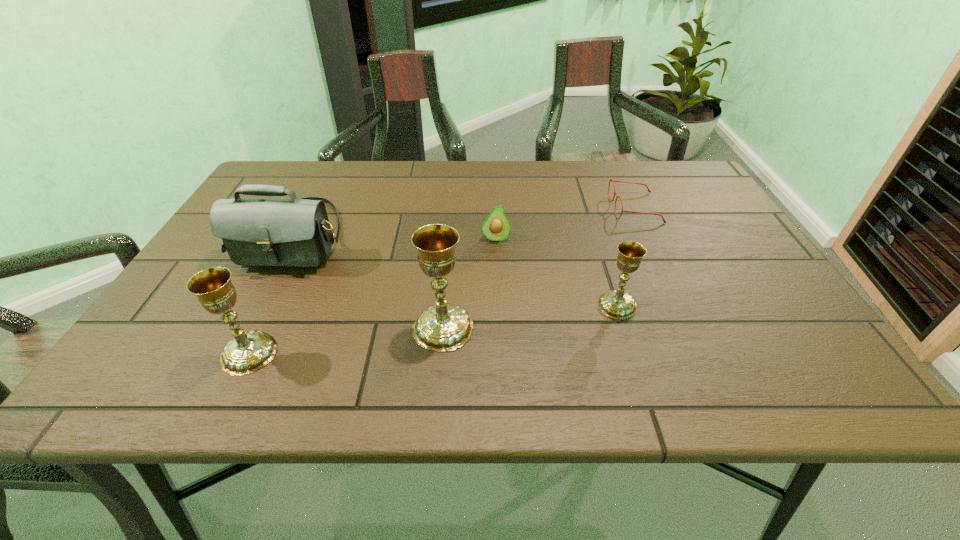
Identify the location of free space located 0.280m on the back of the leftmost chalice. (301, 245).

This screenshot has height=540, width=960. Identify the location of vacant space located 0.210m on the left of the tallest chalice. (307, 328).

At what (x,y) coordinates should I click in order to perform the action: click on blank space located 0.220m on the right of the shortest chalice. Please return your answer as a coordinate pair (x, y). Looking at the image, I should click on (741, 306).

Where is `vacant space situated on the face of the spectacles`? Image resolution: width=960 pixels, height=540 pixels. vacant space situated on the face of the spectacles is located at coordinates (583, 208).

You are a GUI agent. You are given a task and a screenshot of the screen. Output one action in this format:
    pyautogui.click(x=<x>, y=<y>)
    Task: Click on the free spot located 0.230m on the face of the spectacles
    
    Given the screenshot: What is the action you would take?
    pyautogui.click(x=528, y=208)

Locate an element on the screen. The width and height of the screenshot is (960, 540). free space located on the face of the spectacles is located at coordinates 473,208.

The height and width of the screenshot is (540, 960). I want to click on free space located 0.340m on the cut side of the avocado, so click(500, 354).

Locate an element on the screen. This screenshot has height=540, width=960. blank area located on the right of the shoulder bag is located at coordinates [444, 236].

Identify the location of object present at the far edge. (610, 180).

The image size is (960, 540). Identify the location of object that is positioned at the left edge. (296, 232).